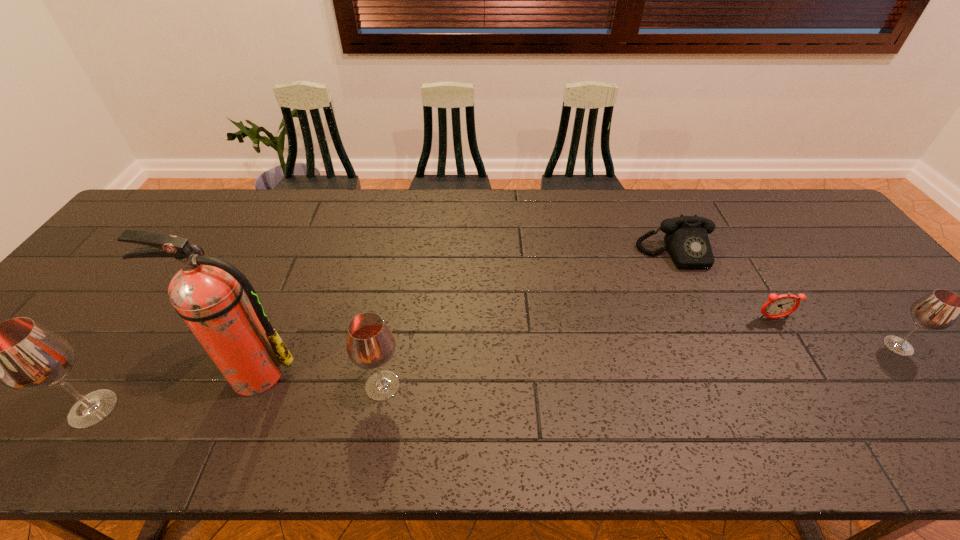
This screenshot has width=960, height=540. I want to click on vacant space at the near edge of the desktop, so click(x=827, y=383).

Find the location of `vacant space at the left edge`. vacant space at the left edge is located at coordinates (99, 282).

What are the coordinates of `vacant space at the right edge of the desktop` in the screenshot? It's located at (919, 343).

The width and height of the screenshot is (960, 540). I want to click on free location at the far left corner of the desktop, so click(x=194, y=202).

Locate an element on the screen. Image resolution: width=960 pixels, height=540 pixels. vacant area at the far right corner is located at coordinates (802, 227).

At what (x,y) coordinates should I click in order to perform the action: click on free point between the third tallest object and the fifth object from left to right. Please return your answer as a coordinate pair (x, y). This screenshot has height=540, width=960. Looking at the image, I should click on (578, 352).

Where is `blank region between the fifth object from left to right and the second wineglass from left to right`? blank region between the fifth object from left to right and the second wineglass from left to right is located at coordinates (578, 352).

At what (x,y) coordinates should I click in order to perform the action: click on unoccupied position between the farthest wineglass and the second tallest wineglass. Please return your answer as a coordinate pair (x, y). The width and height of the screenshot is (960, 540). Looking at the image, I should click on (640, 366).

At what (x,y) coordinates should I click in order to perform the action: click on free spot between the second object from right to left and the tallest object. Please return your answer as a coordinate pair (x, y). Looking at the image, I should click on (514, 346).

Locate an element on the screen. The image size is (960, 540). vacant area between the third tallest object and the second farthest object is located at coordinates (578, 352).